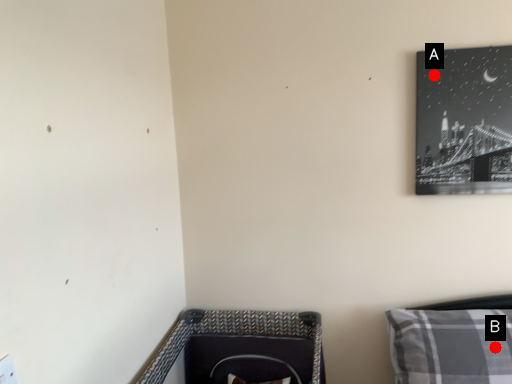
Question: Two points are circled on the image, labeled by A and B beside each circle. Which of the following is the closest to the observer?

Choices:
 (A) A is closer
 (B) B is closer

Answer: (B)